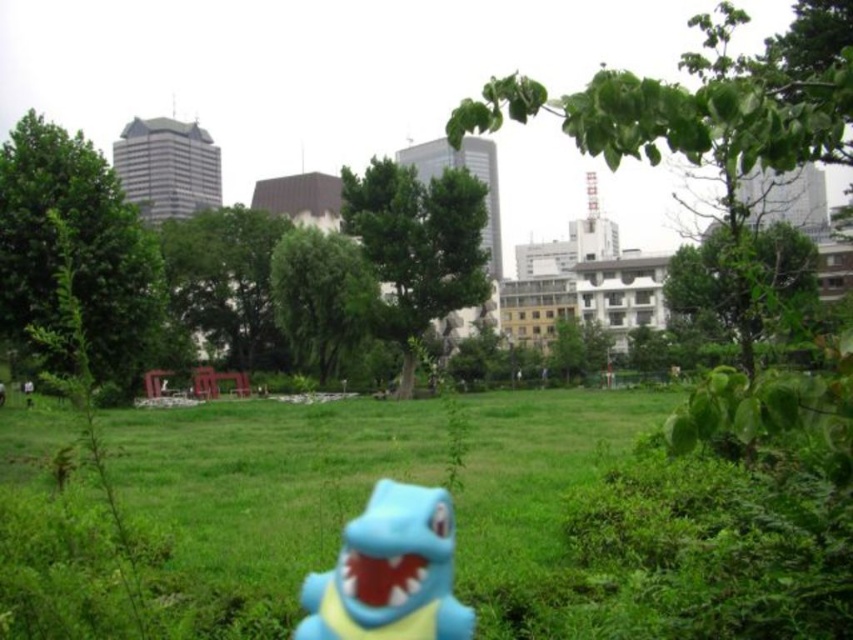
Is green grass at center further to camera compared to blue rubber toy at center?

Yes, green grass at center is behind blue rubber toy at center.

Who is more distant from viewer, (157,436) or (364,634)?

Point (157,436)

Is point (543, 564) farther from camera compared to point (419, 525)?

That is True.

In order to click on green grass at center in this screenshot , I will do `click(641, 528)`.